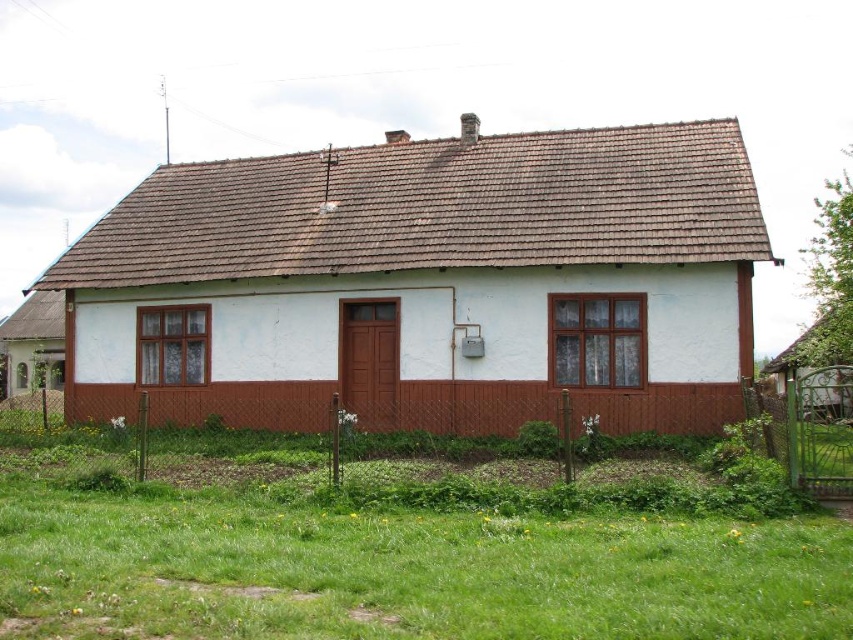
You are a delivery person trying to determine the best path to the front door of the white painted wood cottage at center. There is another white painted wood cottage at lower left nearby. Which cottage should you approach first based on their heights?

The white painted wood cottage at center is taller than the white painted wood cottage at lower left. Therefore, you should approach the taller cottage first, which is the white painted wood cottage at center.

You are standing at the point marked by the coordinates point (428, 284). Which object are you currently at?

You are at the white painted wood cottage at center, as the coordinates point (428, 284) represent its location.

You are standing in front of the house and want to walk towards the green grass at lower center. Which direction should you move relative to the white painted wood cottage at center?

Since the white painted wood cottage at center is to the left of the green grass at lower center, you should move to the right of the white painted wood cottage at center to reach the green grass at lower center.